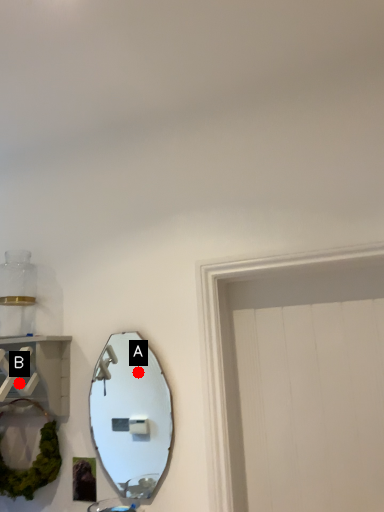
Question: Two points are circled on the image, labeled by A and B beside each circle. Which of the following is the closest to the observer?

Choices:
 (A) A is closer
 (B) B is closer

Answer: (B)